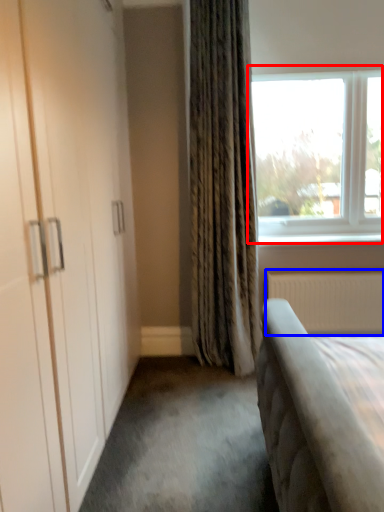
Question: Among these objects, which one is farthest to the camera, window (highlighted by a red box) or radiator (highlighted by a blue box)?

Choices:
 (A) window
 (B) radiator

Answer: (B)